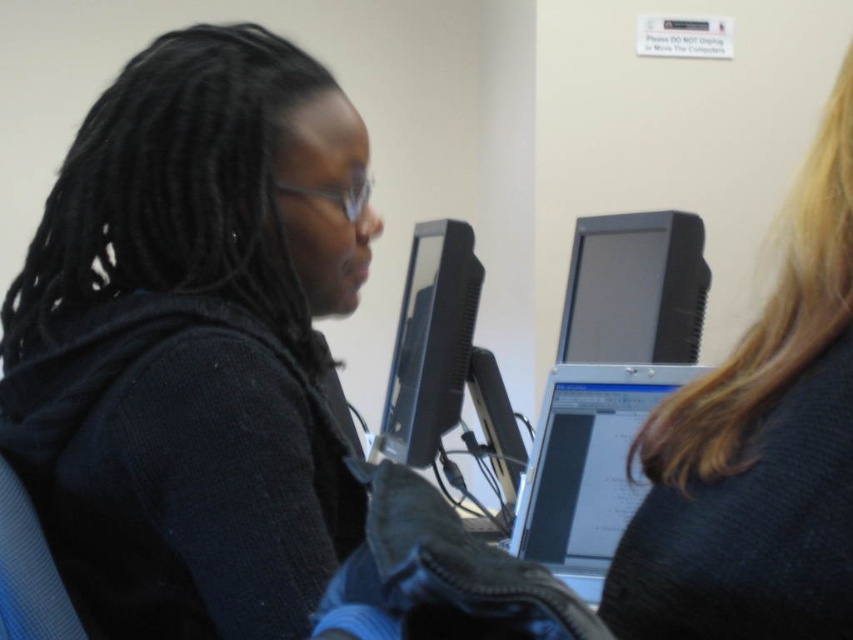
You are a maintenance worker who needs to replace a broken monitor. The broken monitor is at point (x=796, y=304). The replacement monitor is 5 cm wider than the broken one. Can you fit the new monitor without moving the other equipment?

The replacement monitor is 5 cm wider than the broken monitor at point (x=796, y=304). Since the distance between them is 50.25 centimeters, there is enough space to accommodate the new monitor without moving other equipment.

You are standing in front of the workstation and want to place a small object on the closest point between point (x=795, y=609) and point (x=438, y=275). Which point should you choose?

Point (x=795, y=609) is closer to the viewer than point (x=438, y=275), so you should place the object on point (x=795, y=609).

Looking at the workstation setup, where is the blonde hair at upper right in relation to the matte black monitor at upper center?

The blonde hair at upper right is to the left of the matte black monitor at upper center.